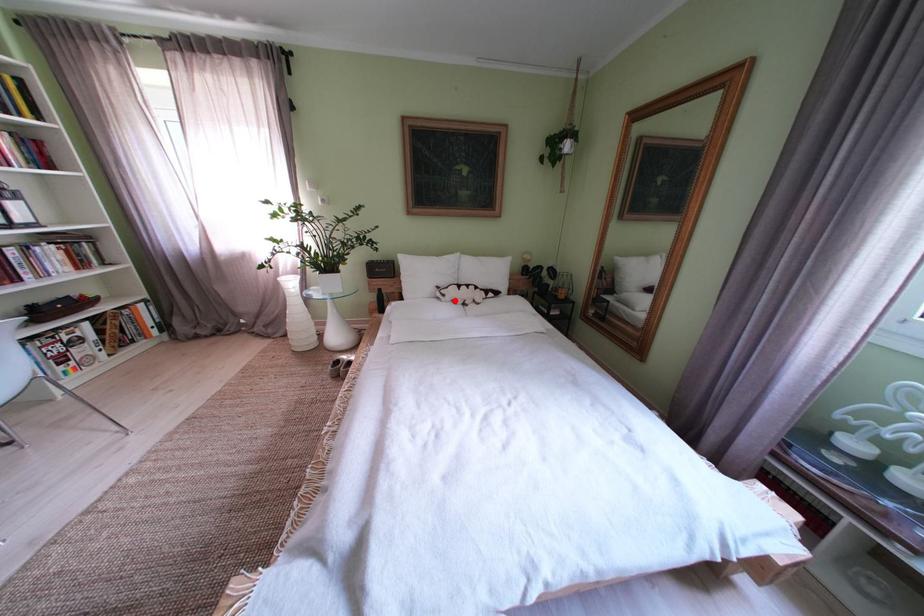
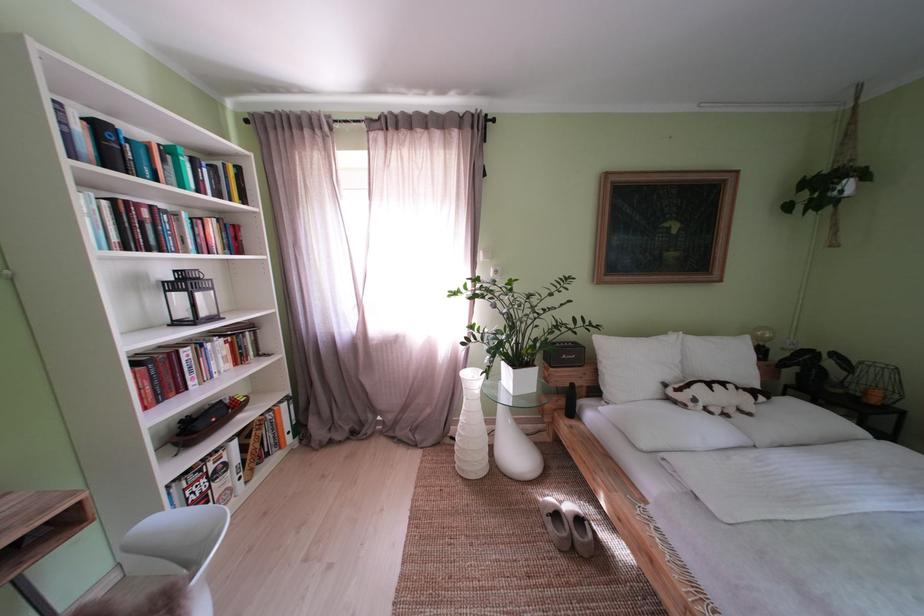
Locate, in the second image, the point that corresponds to the highlighted location in the first image.

(706, 406)